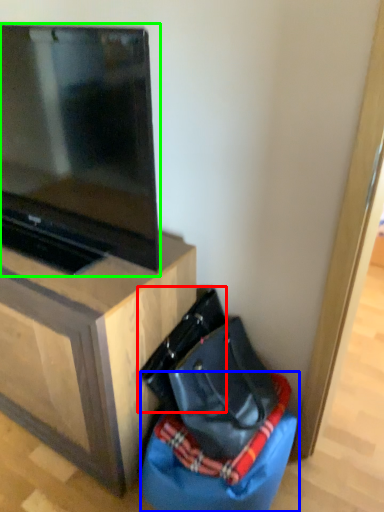
Question: Which object is the closest to the messenger bag (highlighted by a red box)? Choose among these: bean bag chair (highlighted by a blue box) or television (highlighted by a green box).

Choices:
 (A) bean bag chair
 (B) television

Answer: (A)